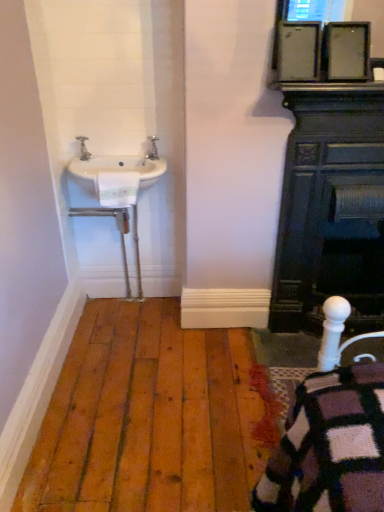
At what (x,y) coordinates should I click in order to perform the action: click on polished brass faucet at upper left, the second tap when ordered from left to right. Please return your answer as a coordinate pair (x, y). The height and width of the screenshot is (512, 384). Looking at the image, I should click on (153, 148).

This screenshot has width=384, height=512. Describe the element at coordinates (331, 208) in the screenshot. I see `black cast iron fireplace at right` at that location.

Locate an element on the screen. silver metallic tap at upper left, the first tap from the left is located at coordinates (83, 148).

What do you see at coordinates (150, 417) in the screenshot?
I see `natural wood floor at lower left` at bounding box center [150, 417].

You are a GUI agent. You are given a task and a screenshot of the screen. Output one action in this format:
    pyautogui.click(x=<x>, y=<y>)
    Task: Click on the polished brass faucet at upper left, the 1th tap in the right-to-left sequence
    The width and height of the screenshot is (384, 512).
    Given the screenshot: What is the action you would take?
    pyautogui.click(x=153, y=148)

Would you say black cast iron fireplace at right contains polished brass faucet at upper left, the second tap when ordered from left to right?

No, polished brass faucet at upper left, the second tap when ordered from left to right, is located outside of black cast iron fireplace at right.

From the picture: Which of these two, black cast iron fireplace at right or polished brass faucet at upper left, the second tap when ordered from left to right, stands taller?

Standing taller between the two is black cast iron fireplace at right.

How different are the orientations of black cast iron fireplace at right and polished brass faucet at upper left, the 1th tap in the right-to-left sequence, in degrees?

black cast iron fireplace at right and polished brass faucet at upper left, the 1th tap in the right-to-left sequence, are facing 0.114 degrees away from each other.

From a real-world perspective, is black cast iron fireplace at right under polished brass faucet at upper left, the second tap when ordered from left to right?

Yes, from a real-world perspective, black cast iron fireplace at right is beneath polished brass faucet at upper left, the second tap when ordered from left to right.

Who is smaller, polished brass faucet at upper left, the second tap when ordered from left to right, or black cast iron fireplace at right?

Smaller between the two is polished brass faucet at upper left, the second tap when ordered from left to right.

Considering the positions of point (155, 153) and point (368, 267), is point (155, 153) closer or farther from the camera than point (368, 267)?

Point (155, 153) is positioned closer to the camera compared to point (368, 267).

Can you confirm if polished brass faucet at upper left, the second tap when ordered from left to right, is wider than black cast iron fireplace at right?

In fact, polished brass faucet at upper left, the second tap when ordered from left to right, might be narrower than black cast iron fireplace at right.

Is the surface of natural wood floor at lower left in direct contact with white ceramic sink at left?

natural wood floor at lower left and white ceramic sink at left are not in contact.

In terms of height, does natural wood floor at lower left look taller or shorter compared to white ceramic sink at left?

natural wood floor at lower left is shorter than white ceramic sink at left.

Considering the sizes of natural wood floor at lower left and white ceramic sink at left in the image, is natural wood floor at lower left wider or thinner than white ceramic sink at left?

Clearly, natural wood floor at lower left has more width compared to white ceramic sink at left.

Can you confirm if white ceramic sink at left is positioned to the right of natural wood floor at lower left?

No, white ceramic sink at left is not to the right of natural wood floor at lower left.

From the image's perspective, is white ceramic sink at left under natural wood floor at lower left?

Actually, white ceramic sink at left appears above natural wood floor at lower left in the image.

Is the surface of white ceramic sink at left in direct contact with natural wood floor at lower left?

They are not placed beside each other.

Which object is further away from the camera, white ceramic sink at left or natural wood floor at lower left?

white ceramic sink at left is more distant.

This screenshot has height=512, width=384. Find the location of `tap that is the 1st object located behind the white ceramic sink at left`. tap that is the 1st object located behind the white ceramic sink at left is located at coordinates coord(83,148).

Between silver metallic tap at upper left, which is the 2th tap from right to left, and white ceramic sink at left, which one has smaller size?

silver metallic tap at upper left, which is the 2th tap from right to left.

Does silver metallic tap at upper left, which is the 2th tap from right to left, have a lesser width compared to white ceramic sink at left?

Yes, silver metallic tap at upper left, which is the 2th tap from right to left, is thinner than white ceramic sink at left.

Looking at this image, can you see silver metallic tap at upper left, which is the 2th tap from right to left, touching white ceramic sink at left?

No, silver metallic tap at upper left, which is the 2th tap from right to left, is not with white ceramic sink at left.

Is silver metallic tap at upper left, the first tap from the left, far away from polished brass faucet at upper left, the second tap when ordered from left to right?

No, there isn't a large distance between silver metallic tap at upper left, the first tap from the left, and polished brass faucet at upper left, the second tap when ordered from left to right.

Is silver metallic tap at upper left, the first tap from the left, facing towards polished brass faucet at upper left, the 1th tap in the right-to-left sequence?

No, silver metallic tap at upper left, the first tap from the left, is not oriented towards polished brass faucet at upper left, the 1th tap in the right-to-left sequence.

Who is shorter, silver metallic tap at upper left, the first tap from the left, or polished brass faucet at upper left, the 1th tap in the right-to-left sequence?

polished brass faucet at upper left, the 1th tap in the right-to-left sequence.

Which is in front, point (81, 151) or point (153, 153)?

The point (81, 151) is in front.

Relative to white ceramic sink at left, is black cast iron fireplace at right in front or behind?

In the image, black cast iron fireplace at right appears in front of white ceramic sink at left.

Considering the sizes of objects black cast iron fireplace at right and white ceramic sink at left in the image provided, who is smaller, black cast iron fireplace at right or white ceramic sink at left?

white ceramic sink at left is smaller.

At what (x,y) coordinates should I click in order to perform the action: click on the 1st tap counting from the left of the black cast iron fireplace at right. Please return your answer as a coordinate pair (x, y). The height and width of the screenshot is (512, 384). Looking at the image, I should click on (153, 148).

Locate an element on the screen. bathroom cabinet on the right of polished brass faucet at upper left, the second tap when ordered from left to right is located at coordinates (331, 208).

Considering their positions, is polished brass faucet at upper left, the 1th tap in the right-to-left sequence, positioned closer to silver metallic tap at upper left, the first tap from the left, than white ceramic sink at left?

Based on the image, white ceramic sink at left appears to be nearer to silver metallic tap at upper left, the first tap from the left.

Looking at the image, which one is located further to natural wood floor at lower left, silver metallic tap at upper left, which is the 2th tap from right to left, or polished brass faucet at upper left, the 1th tap in the right-to-left sequence?

silver metallic tap at upper left, which is the 2th tap from right to left, is positioned further to the anchor natural wood floor at lower left.

From the image, which object appears to be nearer to natural wood floor at lower left, polished brass faucet at upper left, the second tap when ordered from left to right, or silver metallic tap at upper left, which is the 2th tap from right to left?

The object closer to natural wood floor at lower left is polished brass faucet at upper left, the second tap when ordered from left to right.

Looking at the image, which one is located closer to polished brass faucet at upper left, the 1th tap in the right-to-left sequence, silver metallic tap at upper left, which is the 2th tap from right to left, or white ceramic sink at left?

Among the two, white ceramic sink at left is located nearer to polished brass faucet at upper left, the 1th tap in the right-to-left sequence.

Which object lies nearer to the anchor point silver metallic tap at upper left, which is the 2th tap from right to left, black cast iron fireplace at right or white ceramic sink at left?

white ceramic sink at left lies closer to silver metallic tap at upper left, which is the 2th tap from right to left, than the other object.

Which object lies nearer to the anchor point silver metallic tap at upper left, the first tap from the left, natural wood floor at lower left or black cast iron fireplace at right?

Among the two, natural wood floor at lower left is located nearer to silver metallic tap at upper left, the first tap from the left.

Considering their positions, is silver metallic tap at upper left, which is the 2th tap from right to left, positioned closer to white ceramic sink at left than black cast iron fireplace at right?

silver metallic tap at upper left, which is the 2th tap from right to left.

Estimate the real-world distances between objects in this image. Which object is further from white ceramic sink at left, polished brass faucet at upper left, the 1th tap in the right-to-left sequence, or natural wood floor at lower left?

natural wood floor at lower left is further to white ceramic sink at left.

In order to click on sink situated between silver metallic tap at upper left, the first tap from the left, and black cast iron fireplace at right from left to right in this screenshot , I will do `click(113, 177)`.

Image resolution: width=384 pixels, height=512 pixels. What are the coordinates of `sink between polished brass faucet at upper left, the second tap when ordered from left to right, and natural wood floor at lower left in the up-down direction` in the screenshot? It's located at (113, 177).

I want to click on tap between silver metallic tap at upper left, the first tap from the left, and natural wood floor at lower left vertically, so click(153, 148).

Identify the location of hardwood between silver metallic tap at upper left, the first tap from the left, and black cast iron fireplace at right, in the horizontal direction. This screenshot has height=512, width=384. (150, 417).